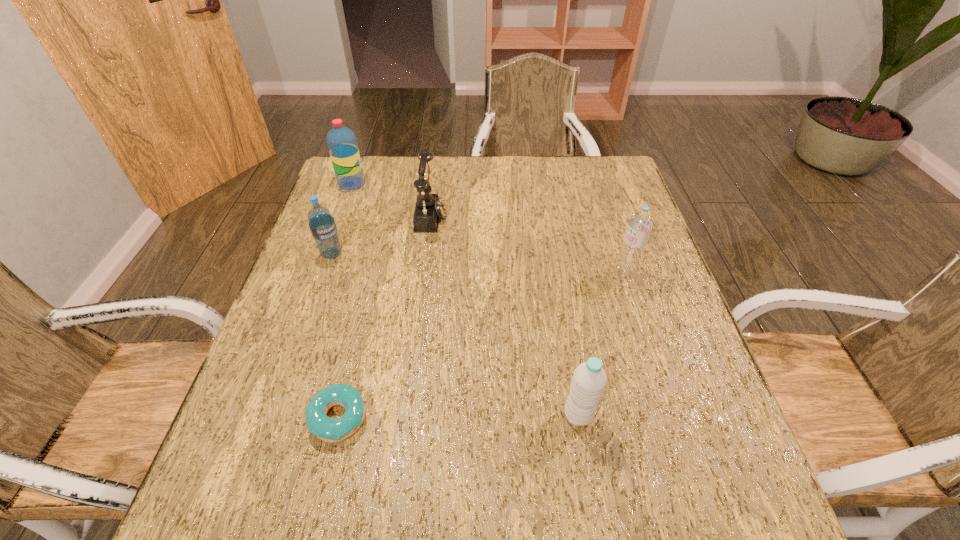
Find the location of `object at the far left corner`. object at the far left corner is located at coordinates (342, 144).

In the image, there is a desktop. Where is `free space at the far edge`? The image size is (960, 540). free space at the far edge is located at coordinates (449, 172).

Image resolution: width=960 pixels, height=540 pixels. In order to click on vacant region at the left edge of the desktop in this screenshot , I will do `click(318, 357)`.

In order to click on vacant space at the right edge of the desktop in this screenshot , I will do `click(685, 349)`.

Where is `free space at the far left corner of the desktop`? This screenshot has height=540, width=960. free space at the far left corner of the desktop is located at coordinates (372, 159).

Locate an element on the screen. Image resolution: width=960 pixels, height=540 pixels. vacant space at the near left corner of the desktop is located at coordinates (194, 522).

What are the coordinates of `vacant region at the far right corner` in the screenshot? It's located at (602, 190).

In the image, there is a desktop. Where is `vacant region at the near right corner`? The image size is (960, 540). vacant region at the near right corner is located at coordinates click(686, 530).

Where is `vacant point located between the third water bottle from left to right and the third farthest object`? Image resolution: width=960 pixels, height=540 pixels. vacant point located between the third water bottle from left to right and the third farthest object is located at coordinates (455, 334).

Locate an element on the screen. Image resolution: width=960 pixels, height=540 pixels. vacant space that's between the third nearest water bottle and the doughnut is located at coordinates (335, 336).